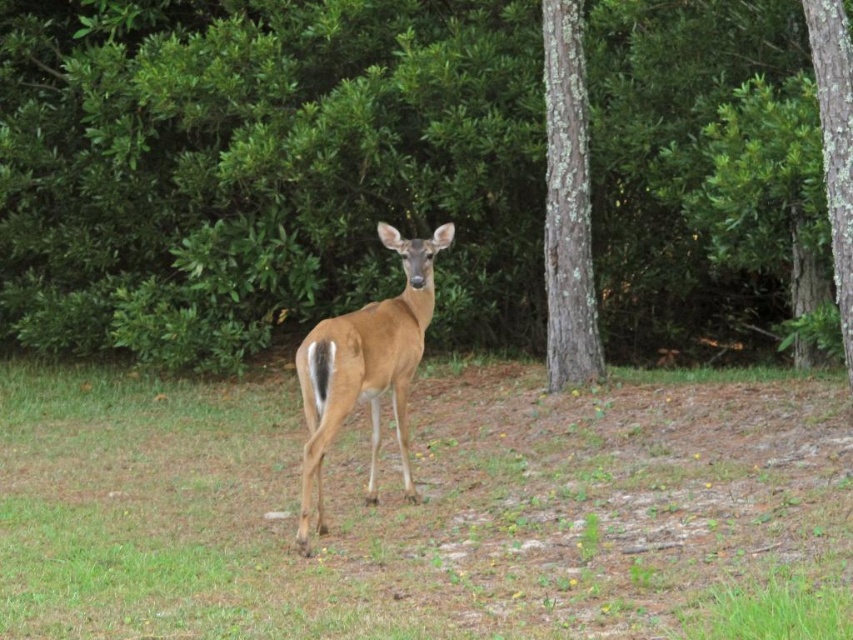
Who is positioned more to the right, green grass at center or brown matte/deer at center?

brown matte/deer at center

Who is higher up, green grass at center or brown matte/deer at center?

brown matte/deer at center is higher up.

Measure the distance between point (602, 420) and camera.

The distance of point (602, 420) from camera is 8.66 meters.

Find the location of a particular element. Image resolution: width=853 pixels, height=640 pixels. green grass at center is located at coordinates (421, 506).

Can you confirm if brown bark tree at center is bigger than green grass at center?

Yes.

Locate an element on the screen. This screenshot has width=853, height=640. brown bark tree at center is located at coordinates (421, 172).

Is green grass at center thinner than smooth bark tree at right?

Incorrect, green grass at center's width is not less than smooth bark tree at right's.

Is the position of green grass at center more distant than that of smooth bark tree at right?

No.

This screenshot has height=640, width=853. What do you see at coordinates (421, 506) in the screenshot?
I see `green grass at center` at bounding box center [421, 506].

Find the location of a particular element. The image size is (853, 640). green grass at center is located at coordinates (421, 506).